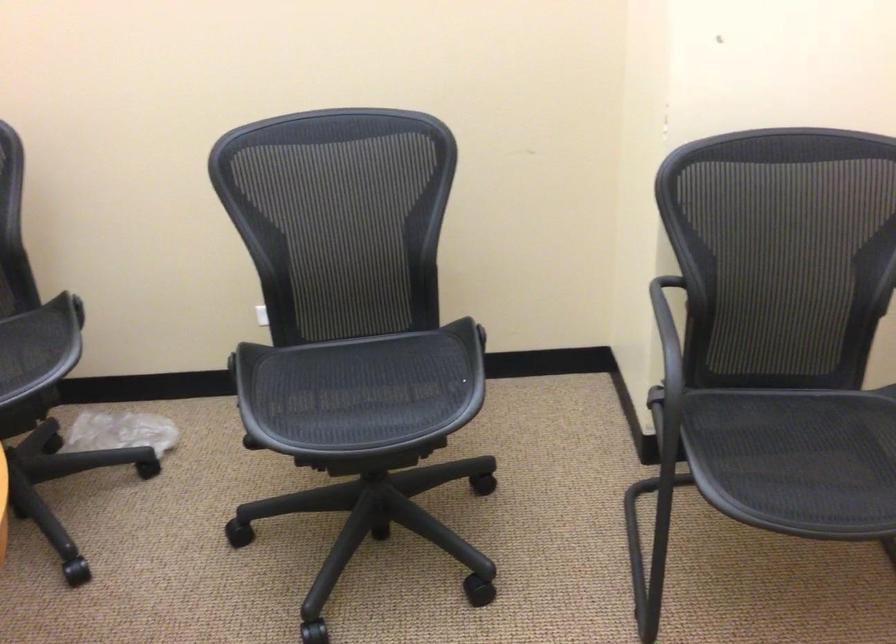
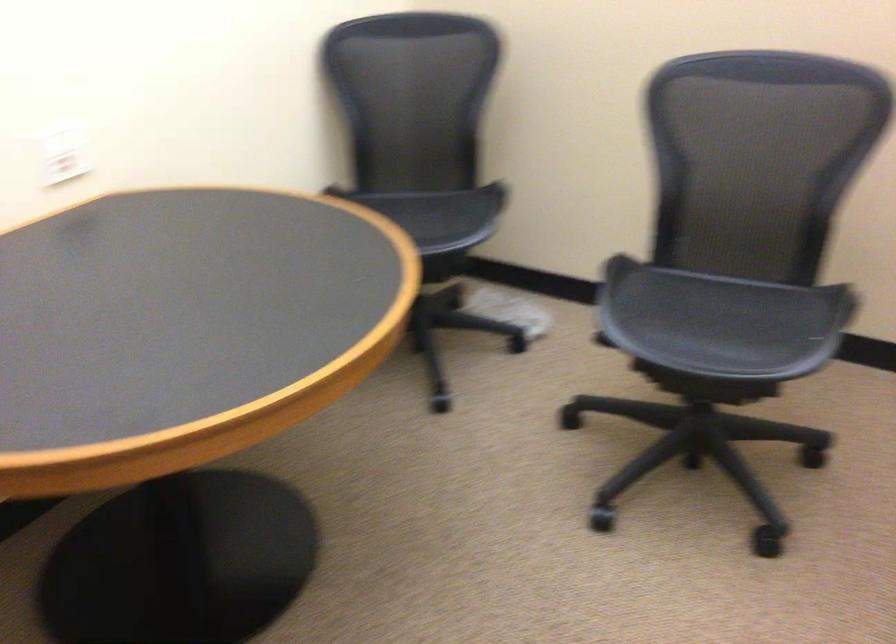
Question: The images are taken continuously from a first-person perspective. In which direction is your viewpoint rotating?

Choices:
 (A) Left
 (B) Right
 (C) Up
 (D) Down

Answer: (A)